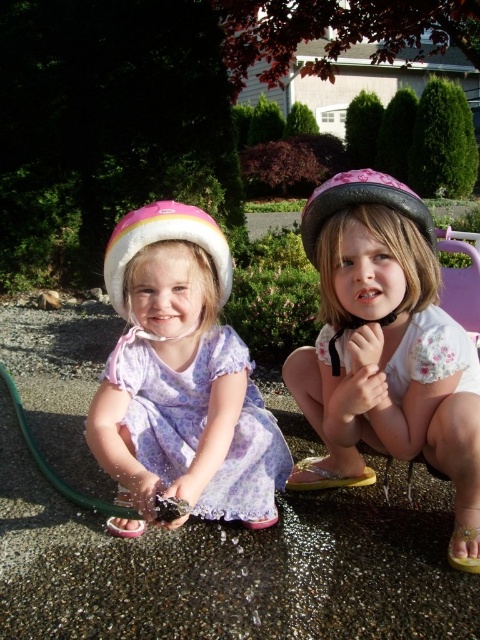
Is point (356, 484) positioned after point (472, 568)?

Yes, it is behind point (472, 568).

Is yellow rubber sandal at lower center above yellow fabric sandal at lower right?

Correct, yellow rubber sandal at lower center is located above yellow fabric sandal at lower right.

Describe the element at coordinates (324, 476) in the screenshot. I see `yellow rubber sandal at lower center` at that location.

Locate an element on the screen. This screenshot has height=640, width=480. yellow rubber sandal at lower center is located at coordinates (324, 476).

Which is more to the right, pink glossy helmet at center or lavender floral dress at center?

pink glossy helmet at center is more to the right.

Measure the distance from pink glossy helmet at center to lavender floral dress at center.

pink glossy helmet at center is 28.38 centimeters from lavender floral dress at center.

Describe the element at coordinates (385, 337) in the screenshot. I see `pink glossy helmet at center` at that location.

This screenshot has width=480, height=640. What are the coordinates of `pink glossy helmet at center` in the screenshot? It's located at (385, 337).

Who is positioned more to the left, lavender floral dress at center or yellow rubber sandal at lower center?

From the viewer's perspective, lavender floral dress at center appears more on the left side.

Does lavender floral dress at center have a larger size compared to yellow rubber sandal at lower center?

Indeed, lavender floral dress at center has a larger size compared to yellow rubber sandal at lower center.

Between point (280, 484) and point (314, 483), which one is positioned behind?

The point (314, 483) is behind.

Image resolution: width=480 pixels, height=640 pixels. Identify the location of lavender floral dress at center. (201, 422).